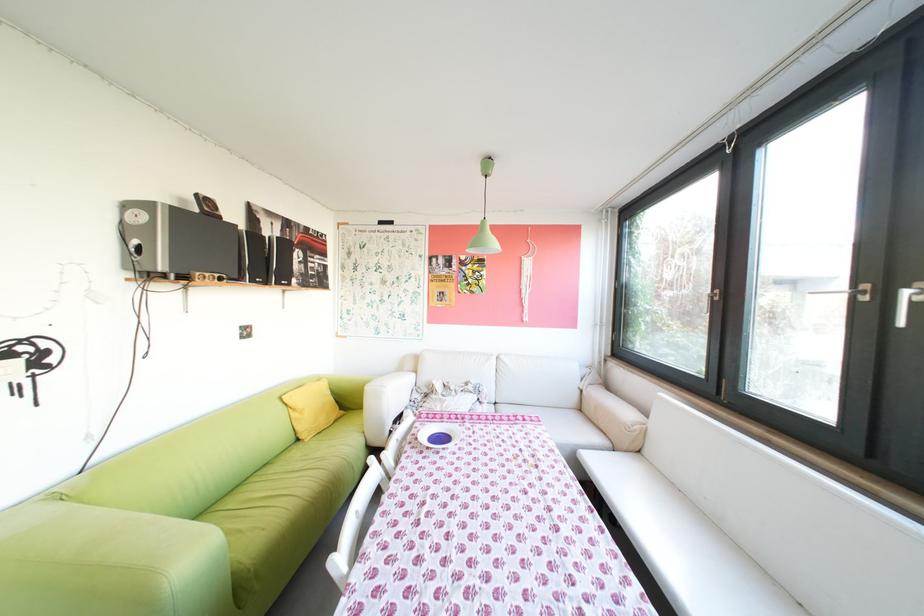
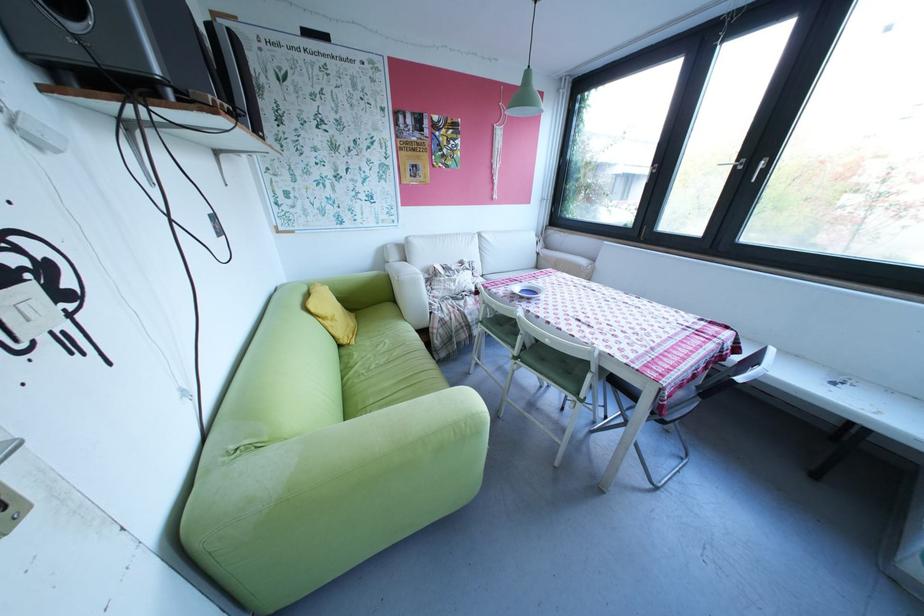
Find the pixel in the second image that matches (441,447) in the first image.

(541, 299)